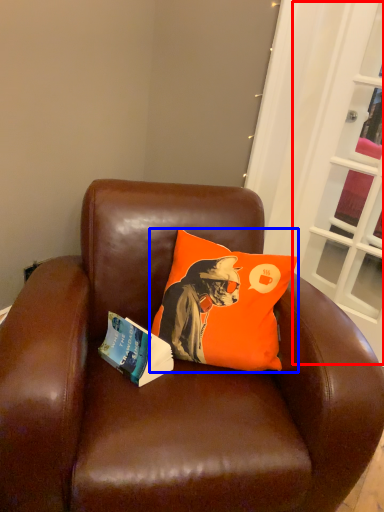
Question: Which object appears closest to the camera in this image, screen door (highlighted by a red box) or pillow (highlighted by a blue box)?

Choices:
 (A) screen door
 (B) pillow

Answer: (B)